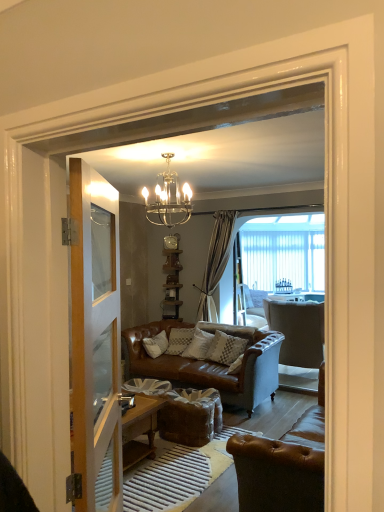
Question: From a real-world perspective, does clear glass door at left sit lower than textured beige pillow at center?

Choices:
 (A) yes
 (B) no

Answer: (B)

Question: Is clear glass door at left wider than textured beige pillow at center?

Choices:
 (A) yes
 (B) no

Answer: (B)

Question: Considering the relative sizes of clear glass door at left and textured beige pillow at center in the image provided, is clear glass door at left thinner than textured beige pillow at center?

Choices:
 (A) no
 (B) yes

Answer: (B)

Question: Is clear glass door at left oriented away from textured beige pillow at center?

Choices:
 (A) no
 (B) yes

Answer: (A)

Question: Is clear glass door at left directly adjacent to textured beige pillow at center?

Choices:
 (A) yes
 (B) no

Answer: (B)

Question: From their relative heights in the image, would you say light gray fabric armchair at center, which appears as the second chair when viewed from the front, is taller or shorter than clear glass chandelier at upper center?

Choices:
 (A) tall
 (B) short

Answer: (A)

Question: Based on their sizes in the image, would you say light gray fabric armchair at center, which appears as the second chair when viewed from the front, is bigger or smaller than clear glass chandelier at upper center?

Choices:
 (A) small
 (B) big

Answer: (B)

Question: From a real-world perspective, is light gray fabric armchair at center, the 1th chair positioned from the back, above or below clear glass chandelier at upper center?

Choices:
 (A) below
 (B) above

Answer: (A)

Question: Considering the positions of point tap(291, 332) and point tap(163, 174), is point tap(291, 332) closer or farther from the camera than point tap(163, 174)?

Choices:
 (A) farther
 (B) closer

Answer: (A)

Question: In terms of height, does textured beige pillow at center look taller or shorter compared to light gray fabric armchair at center, which appears as the second chair when viewed from the front?

Choices:
 (A) short
 (B) tall

Answer: (A)

Question: Based on their sizes in the image, would you say textured beige pillow at center is bigger or smaller than light gray fabric armchair at center, the 1th chair positioned from the back?

Choices:
 (A) small
 (B) big

Answer: (A)

Question: Based on their positions, is textured beige pillow at center located to the left or right of light gray fabric armchair at center, which appears as the second chair when viewed from the front?

Choices:
 (A) right
 (B) left

Answer: (B)

Question: Is textured beige pillow at center inside the boundaries of light gray fabric armchair at center, which appears as the second chair when viewed from the front, or outside?

Choices:
 (A) outside
 (B) inside

Answer: (A)

Question: From a real-world perspective, is clear glass chandelier at upper center physically located above or below light gray fabric armchair at center, the 1th chair positioned from the back?

Choices:
 (A) below
 (B) above

Answer: (B)

Question: From the image's perspective, is clear glass chandelier at upper center located above or below light gray fabric armchair at center, which appears as the second chair when viewed from the front?

Choices:
 (A) below
 (B) above

Answer: (B)